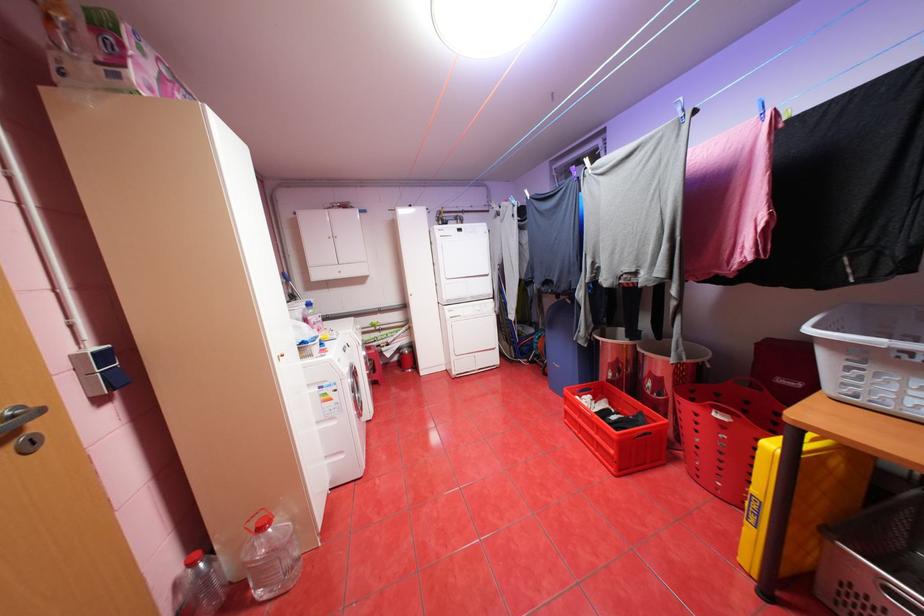
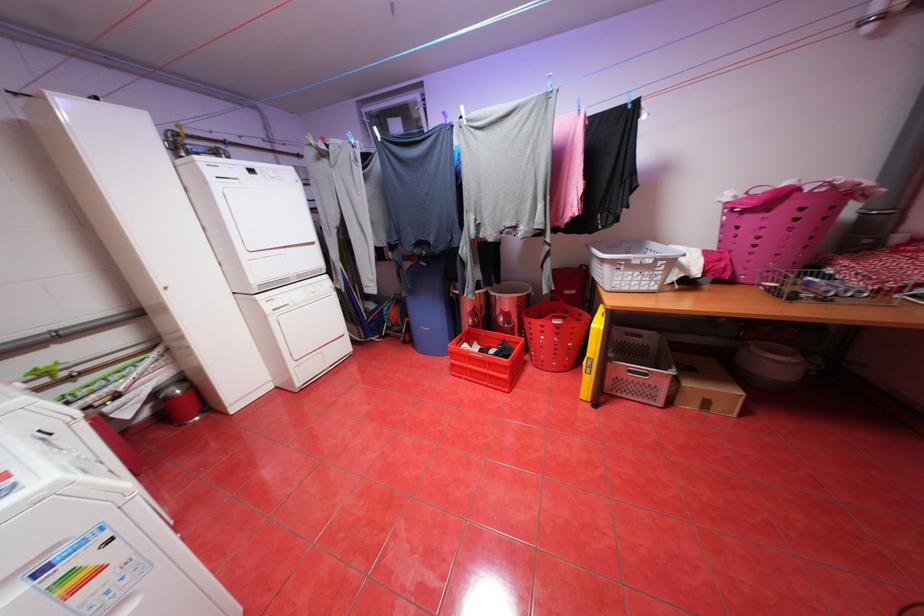
Find the pixel in the second image that matches the point at 706,418 in the first image.

(552, 329)